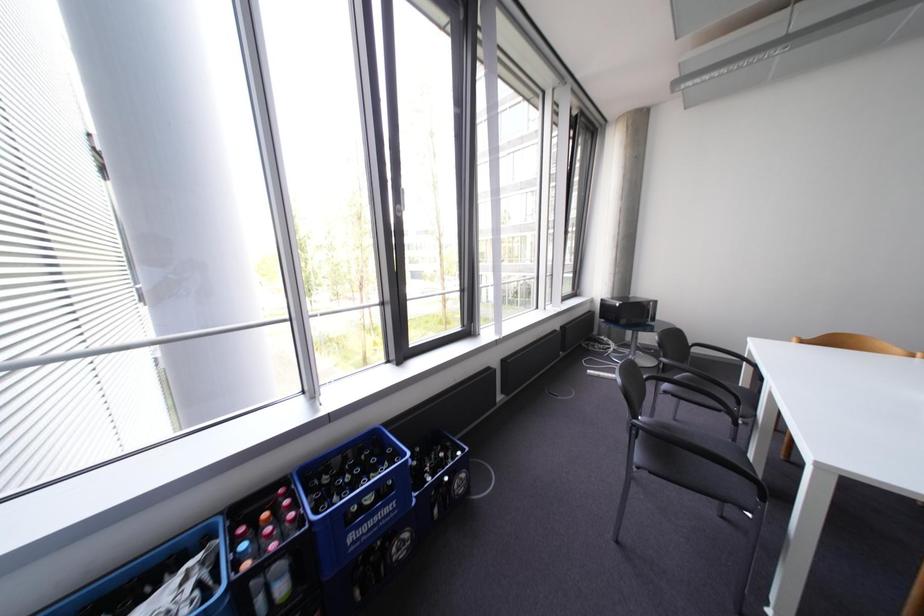
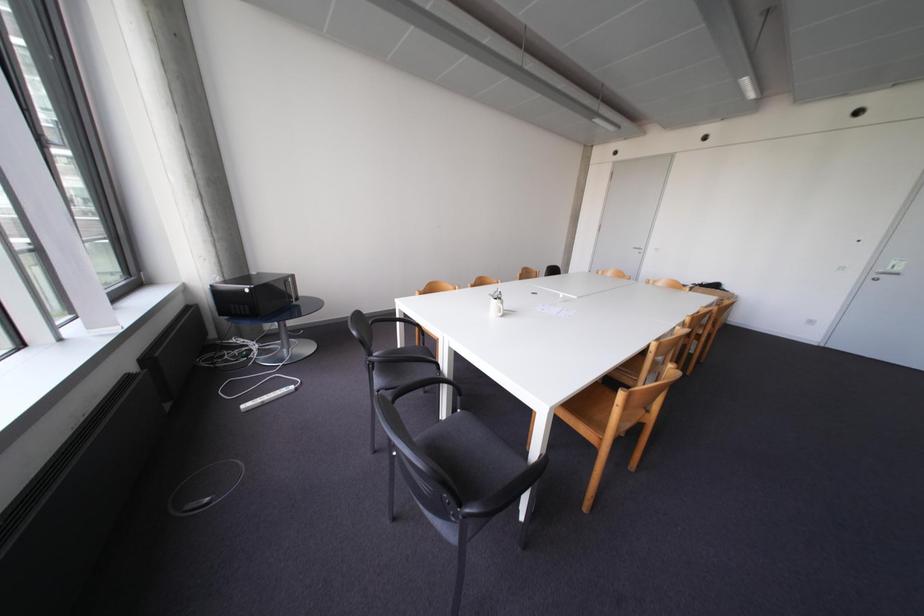
How did the camera likely rotate?

The camera's rotation is toward right-down.